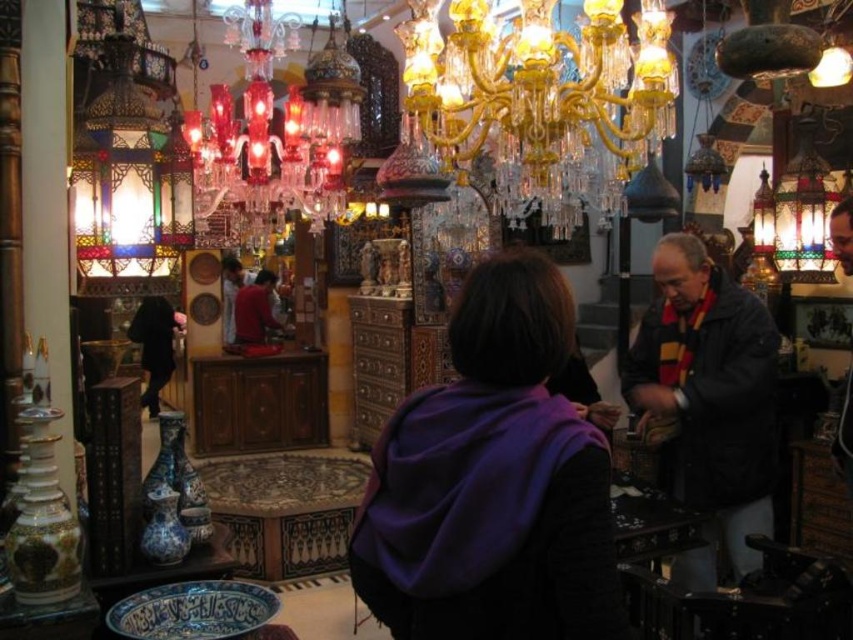
Is dark blue jacket at center in front of matte red shirt at center?

Yes, dark blue jacket at center is in front of matte red shirt at center.

Does dark blue jacket at center have a lesser width compared to matte red shirt at center?

In fact, dark blue jacket at center might be wider than matte red shirt at center.

Which is in front, point (679, 301) or point (257, 280)?

Point (679, 301) is more forward.

Identify the location of dark blue jacket at center. (709, 401).

Can you confirm if purple fabric at center is positioned below multicolored glass lantern at upper right?

Correct, purple fabric at center is located below multicolored glass lantern at upper right.

Can you confirm if purple fabric at center is wider than multicolored glass lantern at upper right?

Yes.

Is point (483, 348) farther from viewer compared to point (814, 112)?

No, (483, 348) is in front of (814, 112).

Locate an element on the screen. The image size is (853, 640). purple fabric at center is located at coordinates (492, 483).

Does purple fabric at center have a greater height compared to translucent glass chandelier at upper left?

In fact, purple fabric at center may be shorter than translucent glass chandelier at upper left.

Is purple fabric at center to the left of translucent glass chandelier at upper left from the viewer's perspective?

In fact, purple fabric at center is to the right of translucent glass chandelier at upper left.

Who is more forward, (566, 422) or (318, 218)?

Point (566, 422) is more forward.

At what (x,y) coordinates should I click in order to perform the action: click on purple fabric at center. Please return your answer as a coordinate pair (x, y). Looking at the image, I should click on (492, 483).